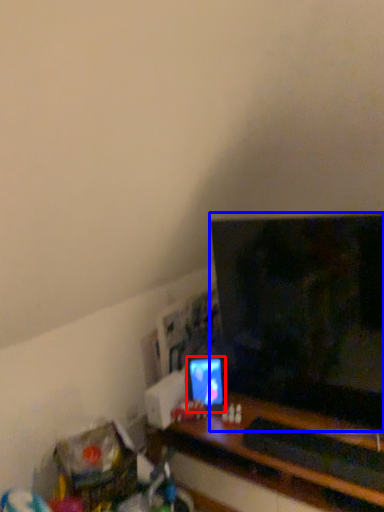
Question: Which object appears farthest to the camera in this image, computer monitor (highlighted by a red box) or television (highlighted by a blue box)?

Choices:
 (A) computer monitor
 (B) television

Answer: (A)